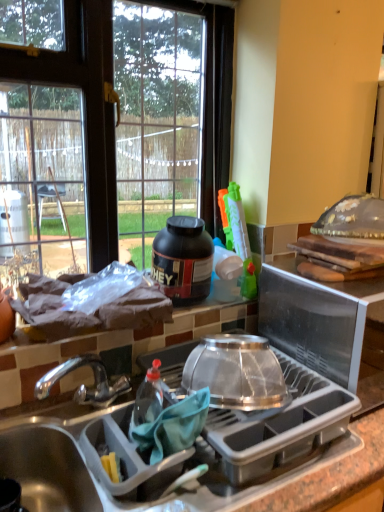
Question: Does point (221, 58) appear closer or farther from the camera than point (77, 501)?

Choices:
 (A) farther
 (B) closer

Answer: (A)

Question: Would you say transparent glass window at upper left is to the left or to the right of matte gray sink at lower left in the picture?

Choices:
 (A) left
 (B) right

Answer: (A)

Question: Which object is positioned closest to the gray plastic dish rack at center?

Choices:
 (A) transparent plastic lid at upper right, the 1th appliance when ordered from right to left
 (B) transparent plastic bowl at center, which appears as the second appliance when viewed from the right
 (C) transparent plastic bowl at center, which is the second kitchen appliance in top-to-bottom order
 (D) black matte protein jar at upper center, arranged as the 1th kitchen appliance when viewed from the back
 (E) transparent glass window at upper left

Answer: (A)

Question: Estimate the real-world distances between objects in this image. Which object is closer to the gray plastic dish rack at center?

Choices:
 (A) transparent plastic lid at upper right, the 1th appliance when ordered from right to left
 (B) black matte protein jar at upper center, the first kitchen appliance when ordered from top to bottom
 (C) transparent glass window at upper left
 (D) matte gray sink at lower left
 (E) transparent plastic bowl at center, which ranks as the 1th appliance in left-to-right order

Answer: (A)